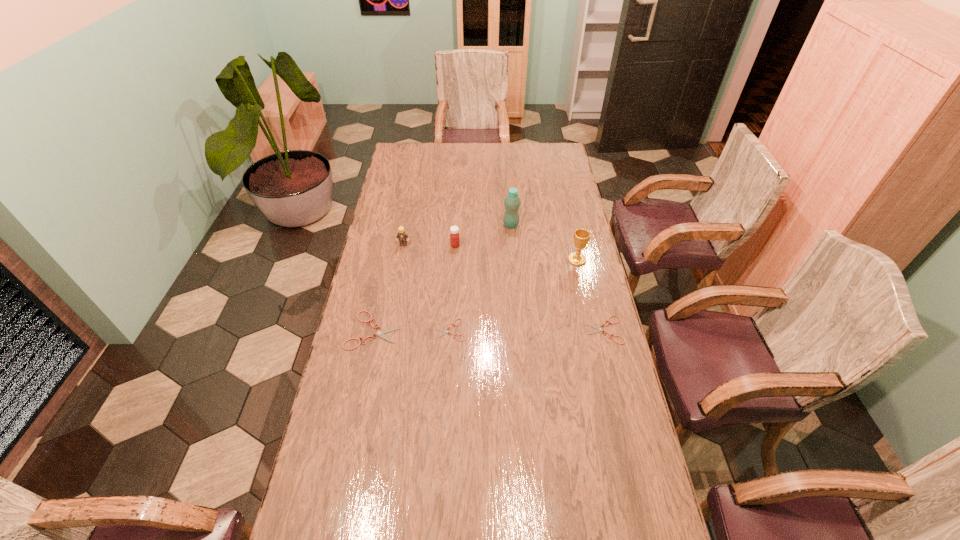
Where is `shears that can be found as the third closest to the medicine`? shears that can be found as the third closest to the medicine is located at coordinates (599, 329).

Where is `vacant space that satisfies the following two spatial constraints: 1. in front of the second shortest object; 2. on the left side of the Lego`? This screenshot has height=540, width=960. vacant space that satisfies the following two spatial constraints: 1. in front of the second shortest object; 2. on the left side of the Lego is located at coordinates (388, 330).

At what (x,y) coordinates should I click in order to perform the action: click on free point that satisfies the following two spatial constraints: 1. on the back side of the leftmost shears; 2. on the right side of the rightmost shears. Please return your answer as a coordinate pair (x, y). This screenshot has width=960, height=540. Looking at the image, I should click on (373, 330).

In order to click on blank space that satisfies the following two spatial constraints: 1. in front of the Lego; 2. on the right side of the second tallest object in this screenshot , I will do `click(400, 260)`.

At what (x,y) coordinates should I click in order to perform the action: click on vacant space that satisfies the following two spatial constraints: 1. at the front cap of the chalice; 2. on the left side of the water bottle. Please return your answer as a coordinate pair (x, y). The height and width of the screenshot is (540, 960). Looking at the image, I should click on tap(514, 260).